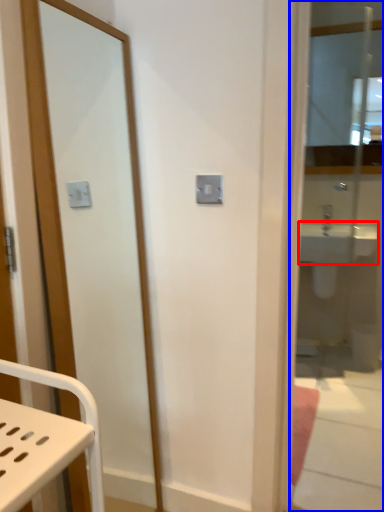
Question: Among these objects, which one is nearest to the camera, sink (highlighted by a red box) or mirror (highlighted by a blue box)?

Choices:
 (A) sink
 (B) mirror

Answer: (B)